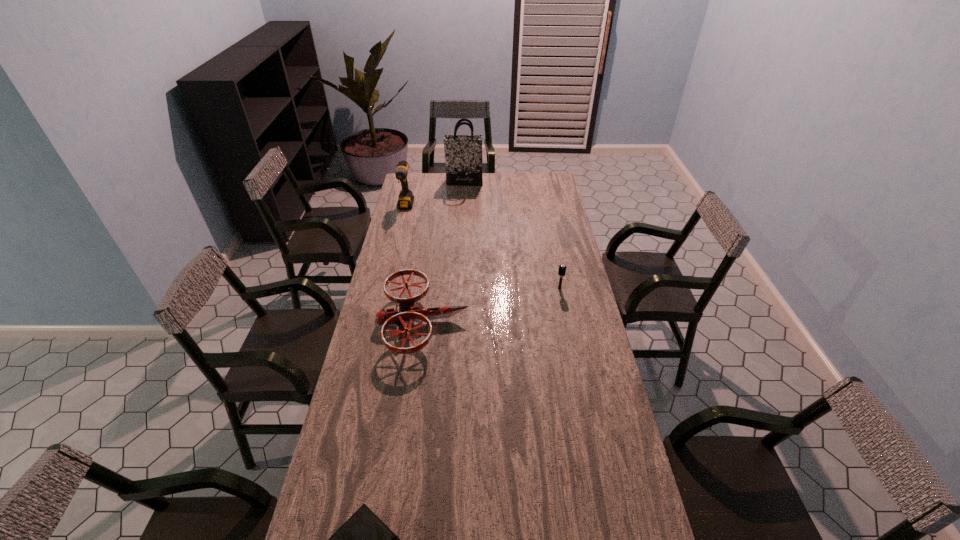
This screenshot has height=540, width=960. Identify the location of shopping bag. (463, 153).

You are a GUI agent. You are given a task and a screenshot of the screen. Output one action in this format:
    pyautogui.click(x=<x>, y=<y>)
    Task: Click on the farthest object
    
    Given the screenshot: What is the action you would take?
    pyautogui.click(x=463, y=153)

The image size is (960, 540). I want to click on the fourth nearest object, so click(406, 198).

The height and width of the screenshot is (540, 960). I want to click on the fourth shortest object, so click(x=406, y=198).

Locate an element on the screen. The width and height of the screenshot is (960, 540). the third shortest object is located at coordinates (562, 268).

The width and height of the screenshot is (960, 540). I want to click on the rightmost object, so click(x=562, y=268).

Find the location of `drone`. drone is located at coordinates (406, 312).

Find the location of `vacant space situated on the front of the tallest object with the design`. vacant space situated on the front of the tallest object with the design is located at coordinates (463, 218).

Where is `blank space located with the drill bit of the second tallest object facing forward`? The height and width of the screenshot is (540, 960). blank space located with the drill bit of the second tallest object facing forward is located at coordinates (401, 224).

I want to click on vacant area situated on the left of the third shortest object, so click(x=514, y=288).